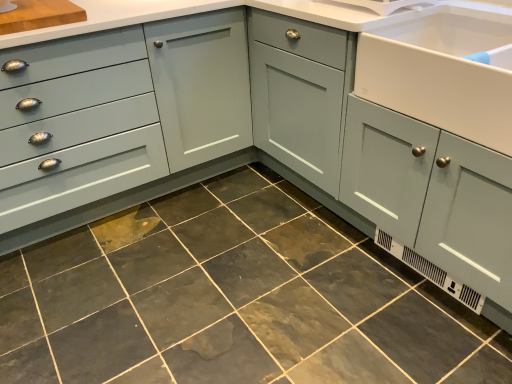
Locate an element on the screen. vacant region above dark gray stone tile at center (from a real-world perspective) is located at coordinates (234, 279).